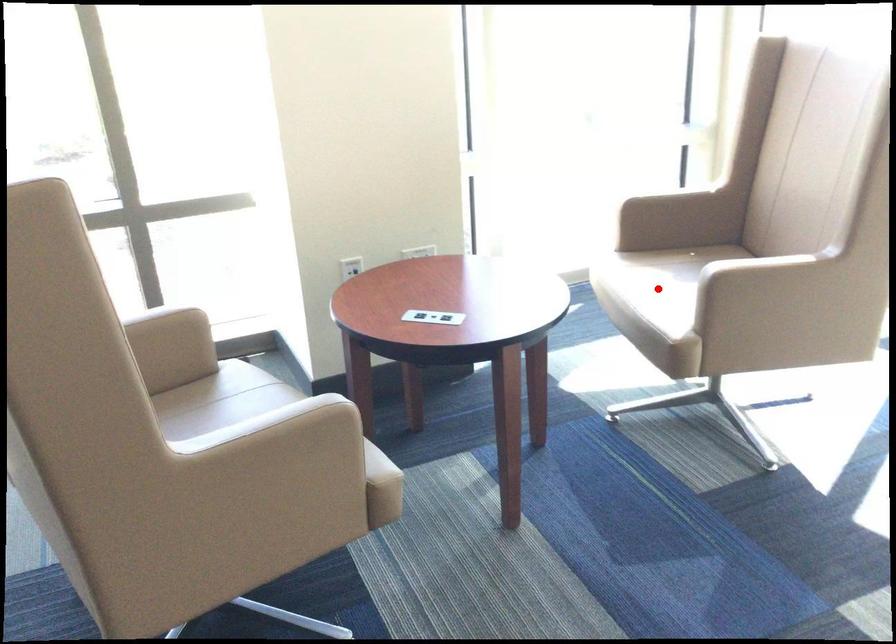
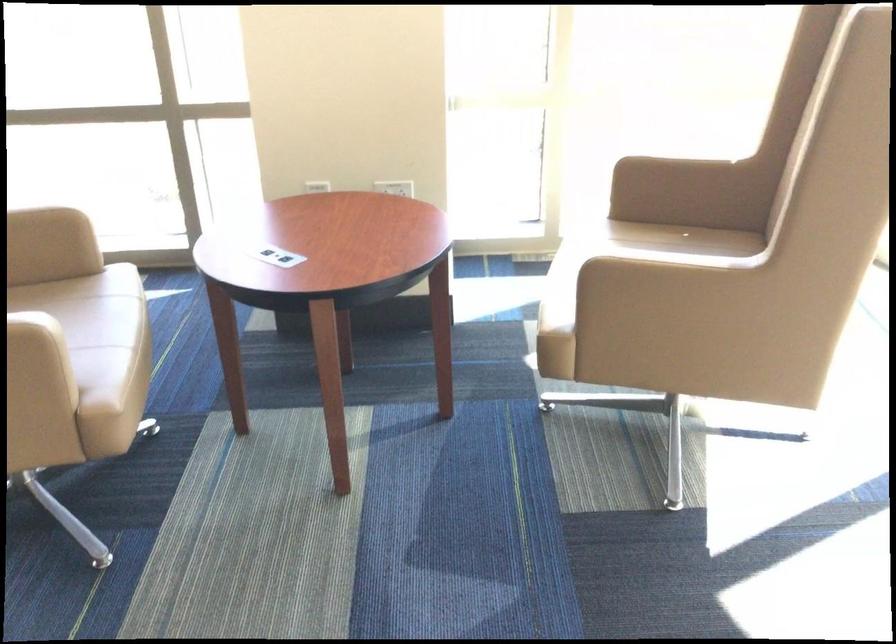
Question: I am providing you with two images of the same scene from different viewpoints. A red point is marked on the first image. At the location where the point appears in image 1, is it still visible in image 2?

Choices:
 (A) Yes
 (B) No

Answer: (B)